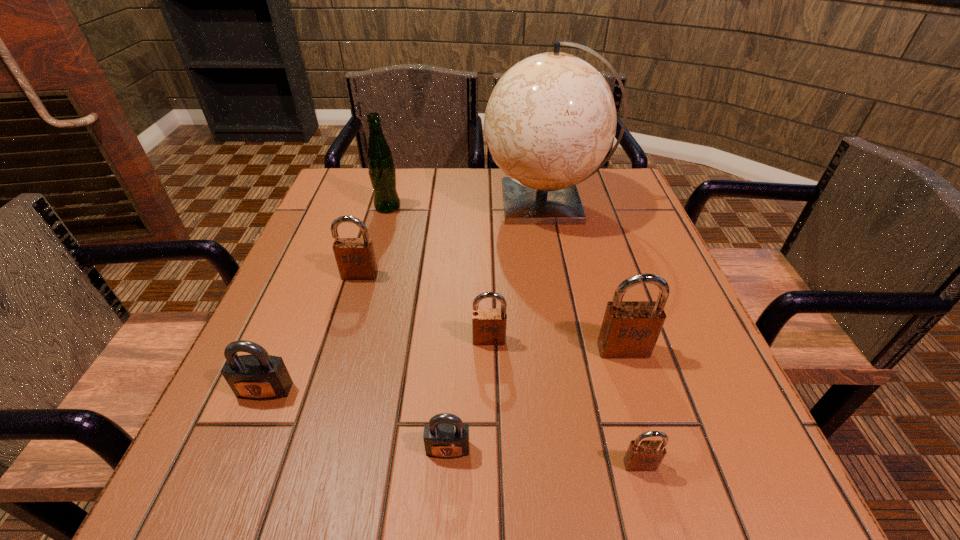
The width and height of the screenshot is (960, 540). In order to click on object located in the near right corner section of the desktop in this screenshot , I will do `click(642, 455)`.

The image size is (960, 540). In order to click on vacant space at the far edge in this screenshot , I will do `click(453, 208)`.

The height and width of the screenshot is (540, 960). I want to click on free region at the near edge of the desktop, so click(x=602, y=460).

You are a GUI agent. You are given a task and a screenshot of the screen. Output one action in this format:
    pyautogui.click(x=<x>, y=<y>)
    Task: Click on the vacant space at the left edge
    
    Given the screenshot: What is the action you would take?
    pyautogui.click(x=345, y=310)

The height and width of the screenshot is (540, 960). I want to click on vacant position at the right edge of the desktop, so click(x=642, y=221).

Where is `free space at the near left corner of the desktop`? This screenshot has width=960, height=540. free space at the near left corner of the desktop is located at coordinates (274, 463).

This screenshot has width=960, height=540. Find the location of `free space at the far right corner`. free space at the far right corner is located at coordinates (620, 177).

Where is `free space between the green beer bottle and the left gray padlock`? The height and width of the screenshot is (540, 960). free space between the green beer bottle and the left gray padlock is located at coordinates (326, 299).

Locate an element on the screen. empty location between the fourth padlock from right to left and the sixth shortest object is located at coordinates (536, 400).

Find the location of a particular element. The width and height of the screenshot is (960, 540). vacant area between the leftmost brown padlock and the third nearest object is located at coordinates pyautogui.click(x=312, y=333).